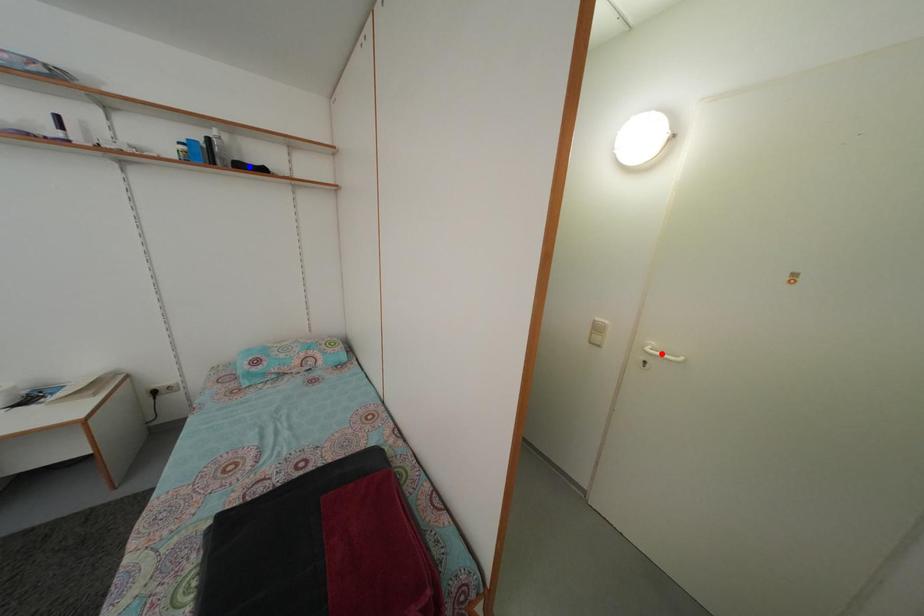
Question: Two points are marked on the image. Which point is closer to the camera?

Choices:
 (A) Blue point is closer.
 (B) Red point is closer.

Answer: (B)